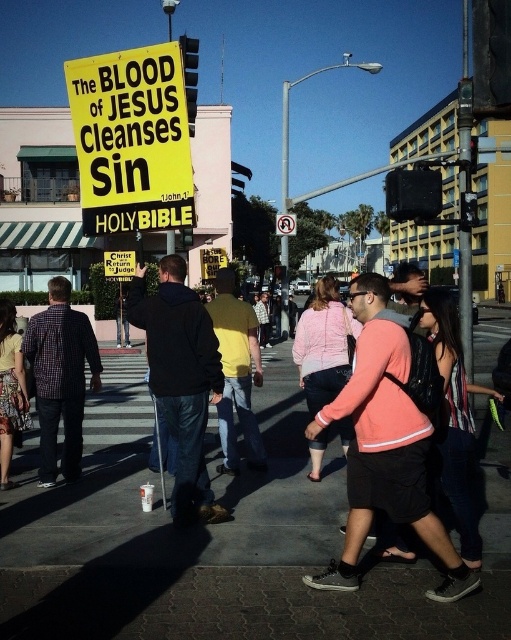
Describe the element at coordinates (222, 548) in the screenshot. I see `gray concrete sidewalk at center` at that location.

Between point (141, 400) and point (185, 154), which one is positioned in front?

Point (185, 154) is more forward.

Is point (57, 496) closer to viewer compared to point (136, 220)?

No, (57, 496) is further to viewer.

You are a GUI agent. You are given a task and a screenshot of the screen. Output one action in this format:
    pyautogui.click(x=<x>, y=<y>)
    Task: Click on the gray concrete sidewalk at center
    The height and width of the screenshot is (640, 511).
    Given the screenshot: What is the action you would take?
    pyautogui.click(x=222, y=548)